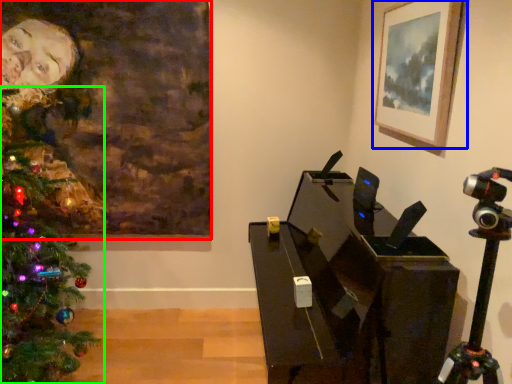
Question: Based on their relative distances, which object is nearer to picture frame (highlighted by a red box)? Choose from picture frame (highlighted by a blue box) and christmas tree (highlighted by a green box).

Choices:
 (A) picture frame
 (B) christmas tree

Answer: (B)